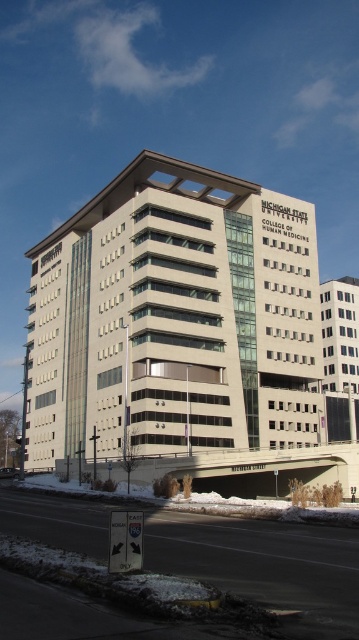
Question: Is white powdery snow at lower left closer to camera compared to white powdery snow at lower center?

Choices:
 (A) yes
 (B) no

Answer: (A)

Question: Can you confirm if white powdery snow at lower left is wider than white powdery snow at lower center?

Choices:
 (A) yes
 (B) no

Answer: (B)

Question: Which point is farther to the camera?

Choices:
 (A) white powdery snow at lower left
 (B) white powdery snow at lower center

Answer: (B)

Question: Which point appears farthest from the camera in this image?

Choices:
 (A) (260, 528)
 (B) (257, 509)

Answer: (B)

Question: Where is white powdery snow at lower left located in relation to white powdery snow at lower center in the image?

Choices:
 (A) above
 (B) below

Answer: (A)